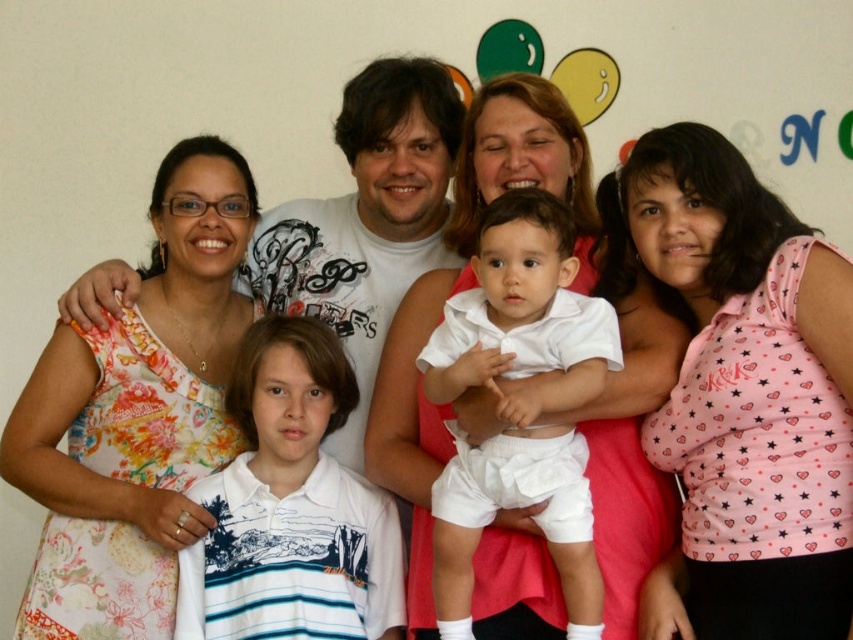
Question: Which of the following is the closest to the observer?

Choices:
 (A) white cotton baby at center
 (B) pink dotted shirt at upper right
 (C) floral dress at left

Answer: (B)

Question: Which point is closer to the camera?

Choices:
 (A) white matte shirt at upper center
 (B) white smooth baby at center
 (C) floral dress at left

Answer: (B)

Question: Which point is farther from the camera taking this photo?

Choices:
 (A) (160, 564)
 (B) (612, 236)

Answer: (B)

Question: Can you confirm if white smooth baby at center is positioned below white cotton baby at center?

Choices:
 (A) yes
 (B) no

Answer: (B)

Question: Is floral dress at left wider than white matte shirt at upper center?

Choices:
 (A) yes
 (B) no

Answer: (B)

Question: Is floral dress at left wider than white cotton baby at center?

Choices:
 (A) no
 (B) yes

Answer: (B)